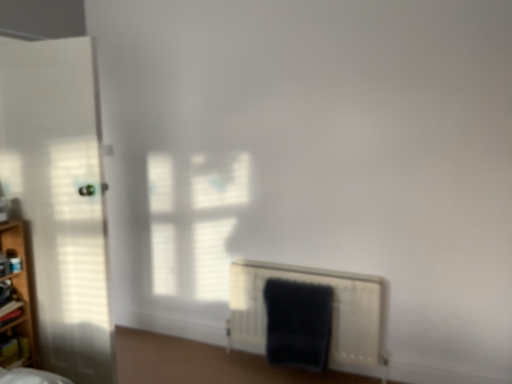
Question: Can you confirm if wooden shelf at left is wider than white matte radiator at lower center?

Choices:
 (A) no
 (B) yes

Answer: (B)

Question: Is wooden shelf at left turned away from white matte radiator at lower center?

Choices:
 (A) yes
 (B) no

Answer: (B)

Question: Is wooden shelf at left positioned in front of white matte radiator at lower center?

Choices:
 (A) yes
 (B) no

Answer: (A)

Question: Is wooden shelf at left at the left side of white matte radiator at lower center?

Choices:
 (A) no
 (B) yes

Answer: (B)

Question: Is wooden shelf at left aimed at white matte radiator at lower center?

Choices:
 (A) no
 (B) yes

Answer: (A)

Question: Is wooden shelf at left next to white matte radiator at lower center?

Choices:
 (A) yes
 (B) no

Answer: (B)

Question: Is dark blue plush bath towel at lower right not inside white matte door at left?

Choices:
 (A) yes
 (B) no

Answer: (A)

Question: From a real-world perspective, is dark blue plush bath towel at lower right positioned over white matte door at left based on gravity?

Choices:
 (A) yes
 (B) no

Answer: (B)

Question: Is dark blue plush bath towel at lower right thinner than white matte door at left?

Choices:
 (A) no
 (B) yes

Answer: (B)

Question: Is the position of dark blue plush bath towel at lower right more distant than that of white matte door at left?

Choices:
 (A) no
 (B) yes

Answer: (B)

Question: Is dark blue plush bath towel at lower right bigger than white matte door at left?

Choices:
 (A) no
 (B) yes

Answer: (A)

Question: Can you confirm if dark blue plush bath towel at lower right is taller than white matte door at left?

Choices:
 (A) yes
 (B) no

Answer: (B)

Question: Does dark blue plush bath towel at lower right have a greater width compared to wooden shelf at left?

Choices:
 (A) yes
 (B) no

Answer: (B)